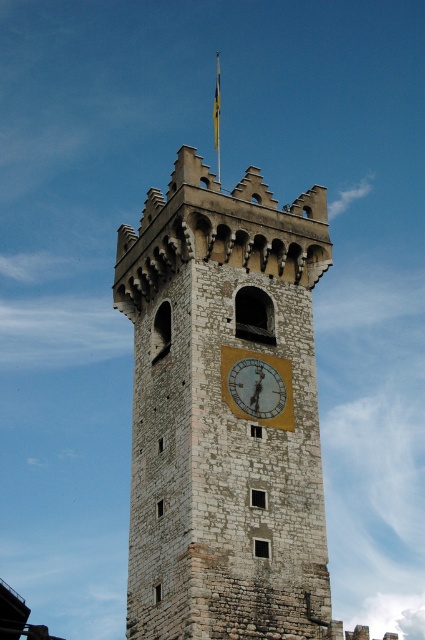
Question: Can you confirm if stone clock tower at center is bigger than gold metallic clock at center?

Choices:
 (A) no
 (B) yes

Answer: (B)

Question: Based on their relative distances, which object is farther from the gold metallic clock at center?

Choices:
 (A) yellow fabric flag at top
 (B) stone clock tower at center

Answer: (A)

Question: Does stone clock tower at center come behind yellow fabric flag at top?

Choices:
 (A) yes
 (B) no

Answer: (B)

Question: Which point is farther from the camera taking this photo?

Choices:
 (A) click(217, 86)
 (B) click(138, 429)

Answer: (A)

Question: Among these points, which one is farthest from the camera?

Choices:
 (A) (155, 225)
 (B) (217, 74)

Answer: (B)

Question: Can you confirm if gold metallic clock at center is bigger than yellow fabric flag at top?

Choices:
 (A) no
 (B) yes

Answer: (A)